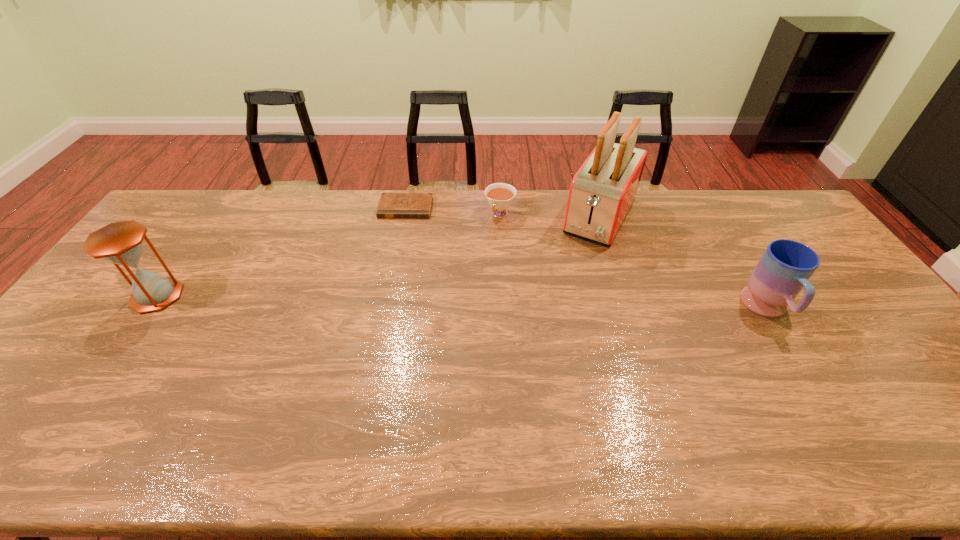
This screenshot has width=960, height=540. I want to click on free space between the fourth object from right to left and the teacup, so click(453, 211).

Find the location of a particular element. This screenshot has height=540, width=960. free spot between the leftmost object and the rightmost object is located at coordinates (463, 303).

This screenshot has height=540, width=960. Find the location of `free point between the hourglass and the toaster`. free point between the hourglass and the toaster is located at coordinates (378, 256).

This screenshot has width=960, height=540. In order to click on unoccupied area between the tallest object and the leftmost object in this screenshot , I will do `click(378, 256)`.

Find the location of a particular element. The height and width of the screenshot is (540, 960). unoccupied position between the third tallest object and the fourth object from right to left is located at coordinates (587, 259).

Locate which object ranks second in proximity to the second object from right to left. Please provide its 2D coordinates. Your answer should be formatted as a tuple, i.e. [(x, y)], where the tuple contains the x and y coordinates of a point satisfying the conditions above.

[(786, 266)]

Identify which object is the second nearest to the diary. Please provide its 2D coordinates. Your answer should be formatted as a tuple, i.e. [(x, y)], where the tuple contains the x and y coordinates of a point satisfying the conditions above.

[(603, 190)]

This screenshot has height=540, width=960. What are the coordinates of `vacant space that satisfies the following two spatial constraints: 1. on the front side of the teacup; 2. on the right side of the fourth object from left to right` in the screenshot? It's located at (500, 217).

Locate an element on the screen. vacant region that satisfies the following two spatial constraints: 1. on the back side of the leftmost object; 2. on the left side of the tallest object is located at coordinates (213, 217).